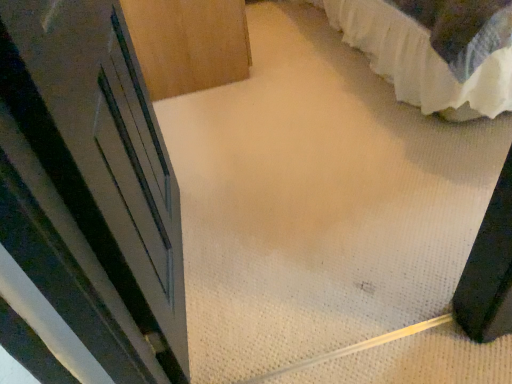
Image resolution: width=512 pixels, height=384 pixels. Identify the location of vacant space underneath metallic gray door at left (from a real-world perspective). (194, 263).